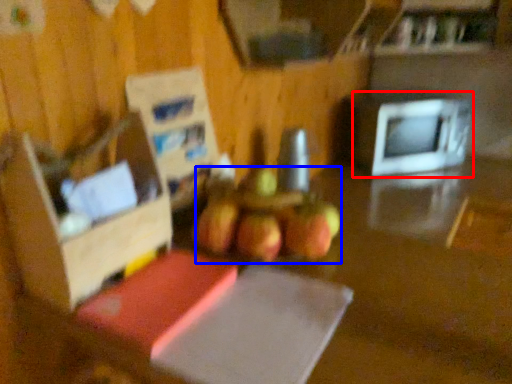
Question: Which object appears farthest to the camera in this image, microwave oven (highlighted by a red box) or apple (highlighted by a blue box)?

Choices:
 (A) microwave oven
 (B) apple

Answer: (A)